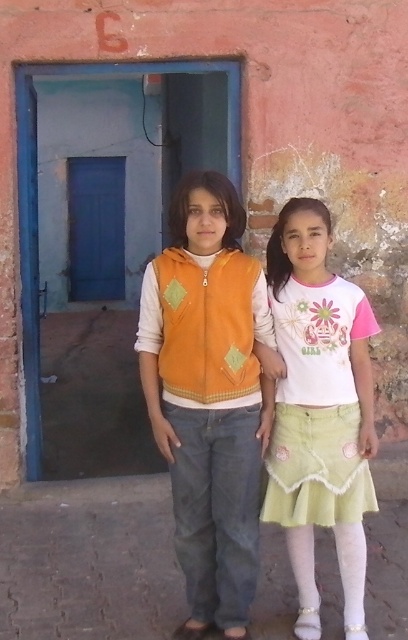
You are standing in front of the building and want to walk from the point marked as point (186, 349) to the point marked as point (361, 326). Will you be moving towards the building or away from it?

Since point (186, 349) is in front of point (361, 326), moving from the former to the latter would mean moving away from the building.

You are a photographer trying to capture a photo of the orange fleece vest at center. The camera you are using has a focal length of 50mm. If you want to ensure the vest is in the center of the photo, where should you position the camera relative to the building?

The orange fleece vest at center is located at coordinates point [208,396]. To center it in the photo, position the camera directly facing the building so that the vest is at the center point of the frame.

You are a photographer trying to capture both the orange fleece vest at center and the white cotton shirt at center in the same frame. Given that your camera has a maximum focus range of 8 inches, will you be able to focus on both subjects simultaneously?

The distance between the orange fleece vest at center and the white cotton shirt at center is 8.95 inches, which exceeds the camera maximum focus range of 8 inches. Therefore, you cannot focus on both subjects simultaneously.